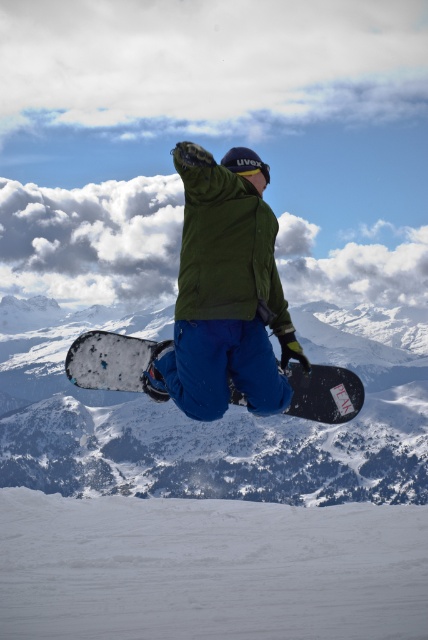
Is white matte snowboard at center wider than black matte snowboard at center?

Yes.

Does white matte snowboard at center have a lesser height compared to black matte snowboard at center?

No, white matte snowboard at center is not shorter than black matte snowboard at center.

This screenshot has height=640, width=428. Find the location of `white matte snowboard at center`. white matte snowboard at center is located at coordinates (211, 493).

Which is behind, point (341, 540) or point (187, 212)?

Positioned behind is point (341, 540).

Based on the photo, is white matte snowboard at center thinner than green matte jacket at center?

Incorrect, white matte snowboard at center's width is not less than green matte jacket at center's.

This screenshot has height=640, width=428. What do you see at coordinates (211, 493) in the screenshot?
I see `white matte snowboard at center` at bounding box center [211, 493].

The image size is (428, 640). What are the coordinates of `white matte snowboard at center` in the screenshot? It's located at (211, 493).

Between point (192, 196) and point (344, 378), which one is positioned behind?

Positioned behind is point (344, 378).

Is point (214, 176) positioned before point (103, 360)?

Yes, it is in front of point (103, 360).

Between point (187, 301) and point (317, 388), which one is positioned in front?

Point (187, 301) is more forward.

What are the coordinates of `green matte jacket at center` in the screenshot? It's located at (223, 248).